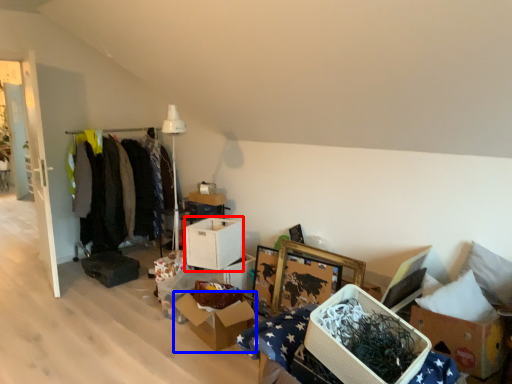
Question: Which of the following is the farthest to the observer, storage box (highlighted by a red box) or cardboard box (highlighted by a blue box)?

Choices:
 (A) storage box
 (B) cardboard box

Answer: (A)